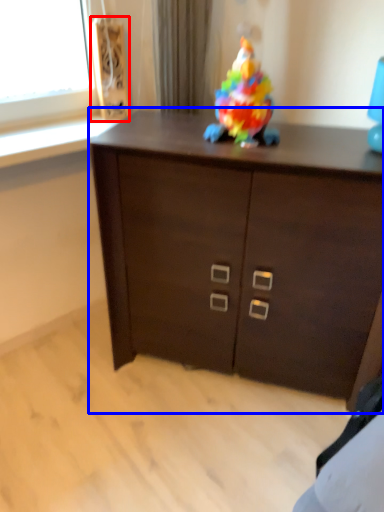
Question: Which object appears closest to the camera in this image, speaker (highlighted by a red box) or chest of drawers (highlighted by a blue box)?

Choices:
 (A) speaker
 (B) chest of drawers

Answer: (B)